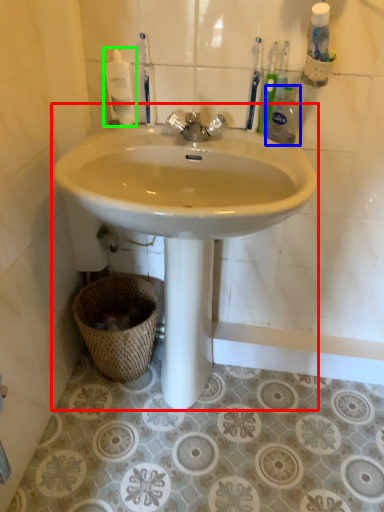
Question: Considering the real-world distances, which object is closest to sink (highlighted by a red box)? cleaning product (highlighted by a blue box) or mouthwash (highlighted by a green box).

Choices:
 (A) cleaning product
 (B) mouthwash

Answer: (A)